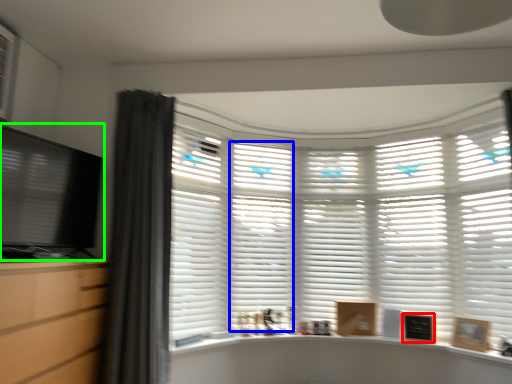
Question: Estimate the real-world distances between objects in this image. Which object is closer to picture frame (highlighted by a red box), shutter (highlighted by a blue box) or computer monitor (highlighted by a green box)?

Choices:
 (A) shutter
 (B) computer monitor

Answer: (A)